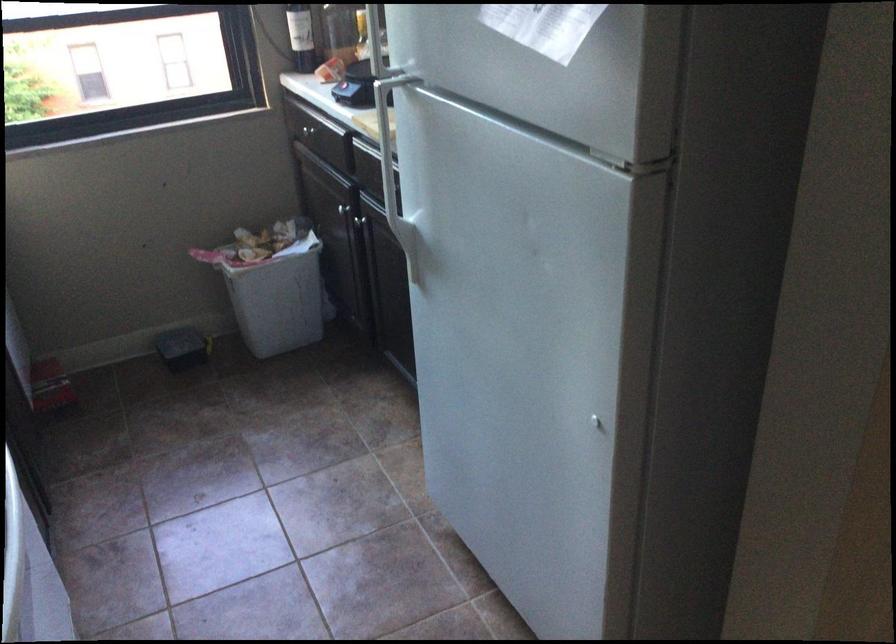
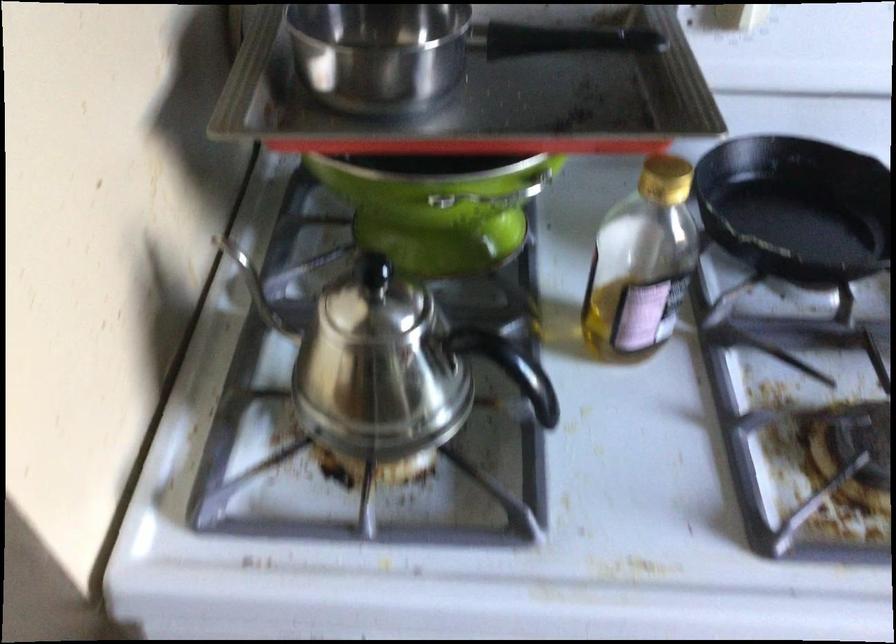
How did the camera likely rotate?

The rotation direction of the camera is left-down.